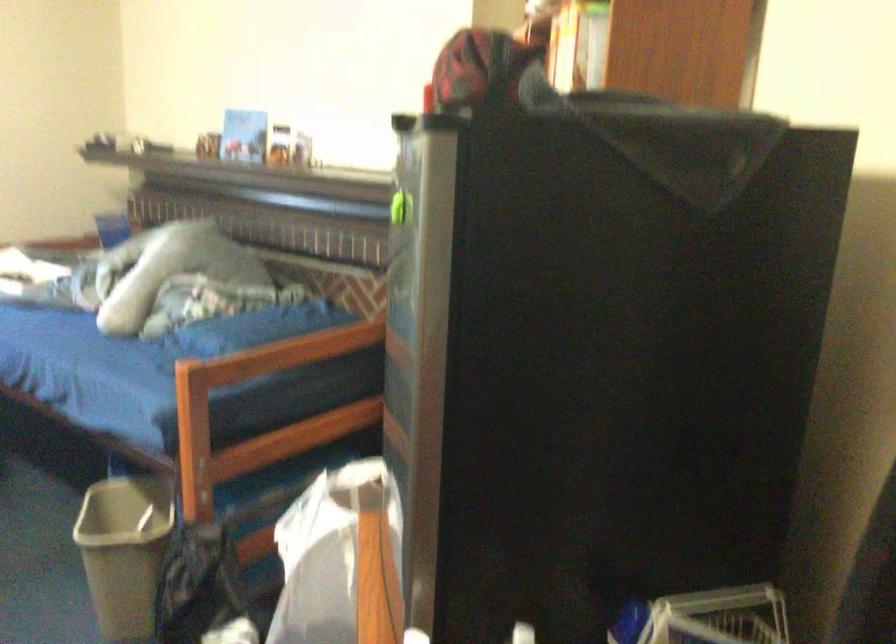
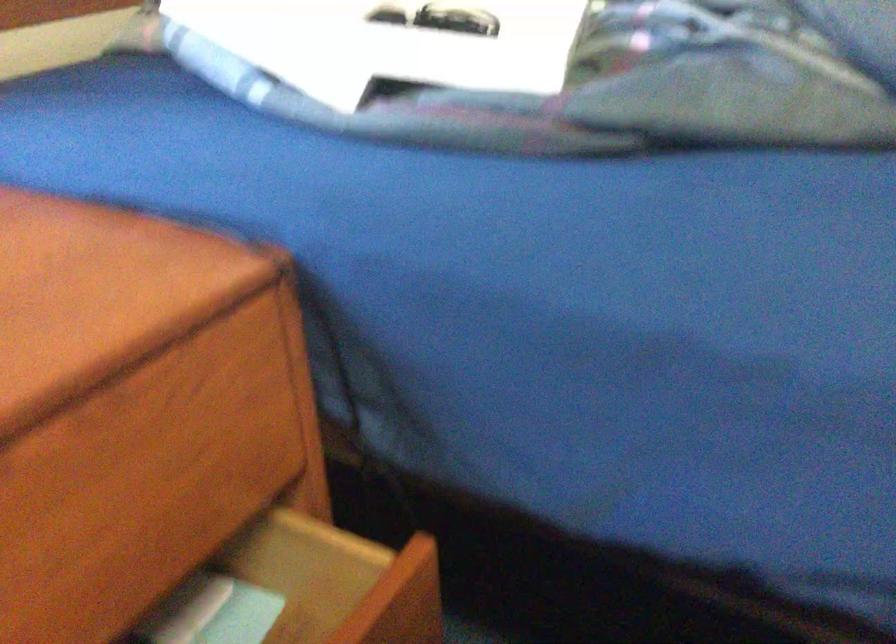
What movement of the cameraman would produce the second image?

The cameraman walked toward left, forward.